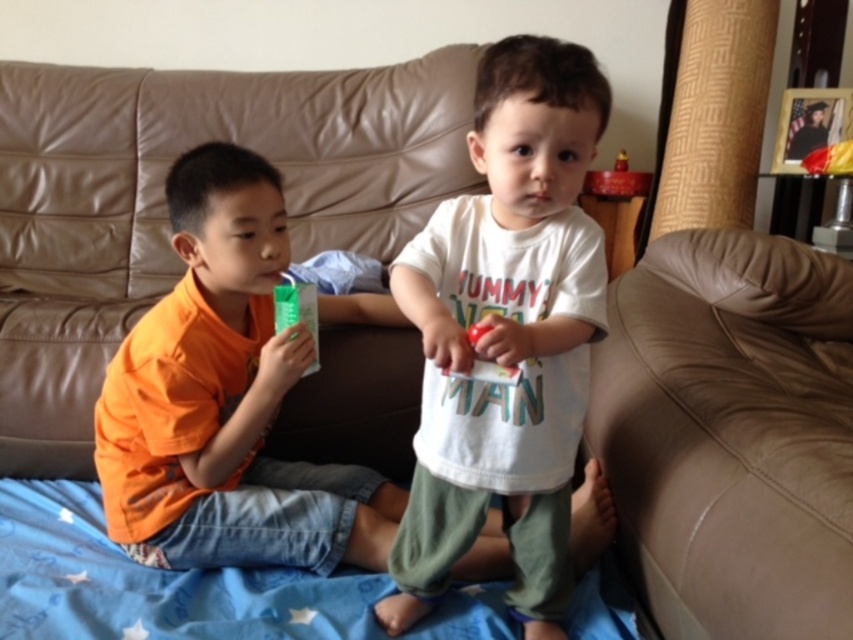
Which is behind, point (519, 186) or point (221, 257)?

Point (221, 257)

Is the position of white cotton shirt at center more distant than that of orange cotton shirt at left?

No, it is in front of orange cotton shirt at left.

This screenshot has width=853, height=640. I want to click on white cotton shirt at center, so click(x=506, y=333).